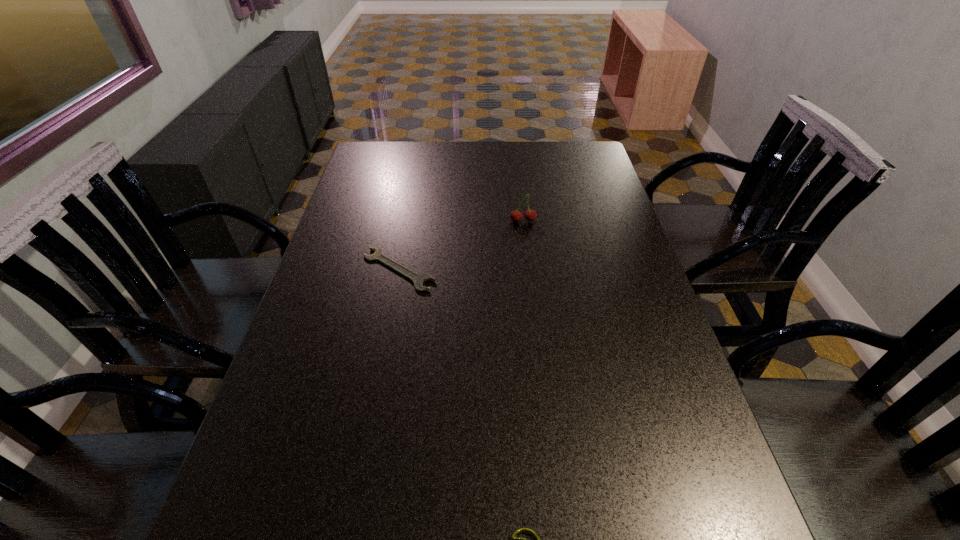
In order to click on the farthest object in this screenshot , I will do `click(530, 215)`.

Locate an element on the screen. the tallest object is located at coordinates (530, 215).

Locate an element on the screen. the left wrench is located at coordinates (418, 279).

Where is `the leftmost object`? The image size is (960, 540). the leftmost object is located at coordinates pyautogui.click(x=418, y=279).

The image size is (960, 540). Identify the location of free space located 0.380m on the surface of the farthest object. (535, 319).

Locate an element on the screen. The width and height of the screenshot is (960, 540). free space located on the back of the left wrench is located at coordinates (412, 200).

Identify the location of object that is at the left edge. This screenshot has width=960, height=540. (418, 279).

In the image, there is a desktop. Where is `vacant space at the far edge`? The image size is (960, 540). vacant space at the far edge is located at coordinates point(408,174).

At what (x,y) coordinates should I click in order to perform the action: click on vacant area at the left edge of the desktop. Please return your answer as a coordinate pair (x, y). Looking at the image, I should click on (277, 471).

Where is `vacant area at the right edge of the desktop`? The image size is (960, 540). vacant area at the right edge of the desktop is located at coordinates (611, 359).